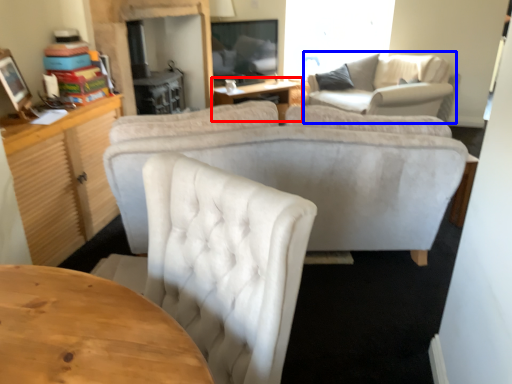
Question: Which of the following is the farthest to the observer, table (highlighted by a red box) or couch (highlighted by a blue box)?

Choices:
 (A) table
 (B) couch

Answer: (A)